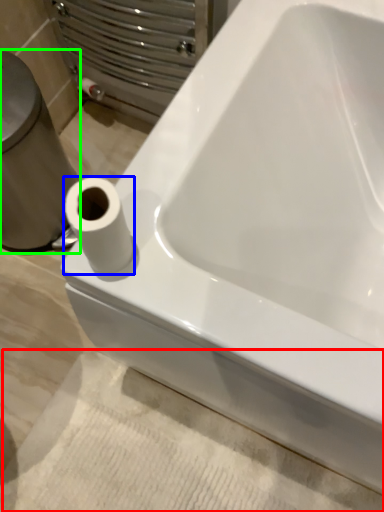
Question: Based on their relative distances, which object is farther from bath mat (highlighted by a red box)? Choose from toilet paper (highlighted by a blue box) and porcelain (highlighted by a green box).

Choices:
 (A) toilet paper
 (B) porcelain

Answer: (A)